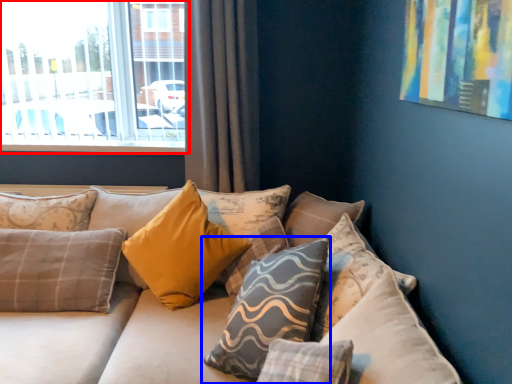
Question: Which object appears closest to the camera in this image, window (highlighted by a red box) or pillow (highlighted by a blue box)?

Choices:
 (A) window
 (B) pillow

Answer: (B)